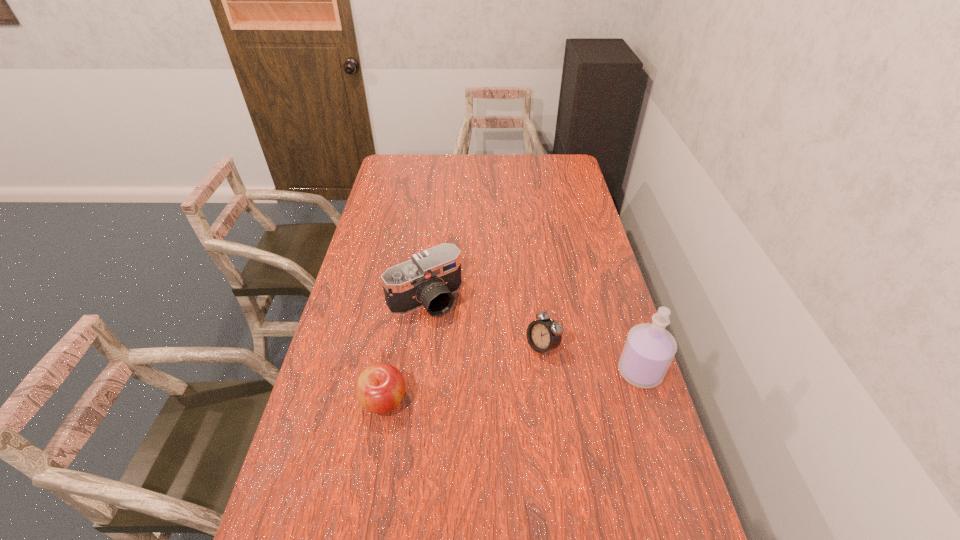
At what (x,y) coordinates should I click in order to perform the action: click on vacant space on the desktop that is between the apple and the rightmost object and is positioned on the face of the alarm clock. Please return your answer as a coordinate pair (x, y). This screenshot has width=960, height=540. Looking at the image, I should click on (477, 390).

I want to click on vacant space on the desktop that is between the apple and the rightmost object and is positioned on the front-facing side of the camera, so click(x=492, y=388).